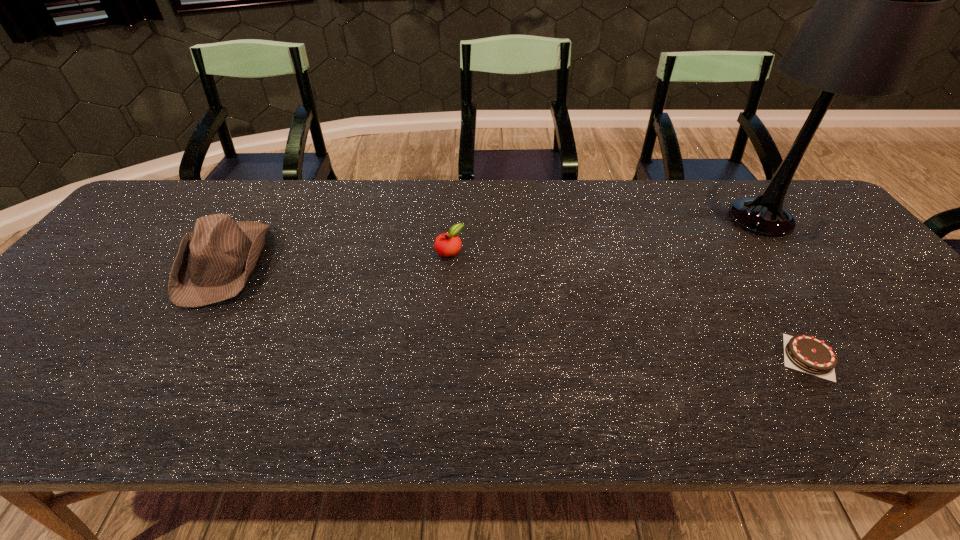
I want to click on table lamp, so click(x=878, y=0).

Image resolution: width=960 pixels, height=540 pixels. Find the location of `fedora`. fedora is located at coordinates (214, 262).

Identify the location of the leftmost object. The image size is (960, 540). (214, 262).

This screenshot has width=960, height=540. In order to click on the third object from right to left in this screenshot , I will do click(x=448, y=244).

Find the location of `the second shortest object`. the second shortest object is located at coordinates (448, 244).

Locate an element on the screen. The image size is (960, 540). the shortest object is located at coordinates (805, 353).

Image resolution: width=960 pixels, height=540 pixels. I want to click on the nearest object, so click(x=805, y=353).

At what (x,y) coordinates should I click in order to perform the action: click on free region located on the left of the table lamp. Please return your answer as a coordinate pair (x, y). This screenshot has height=540, width=960. Looking at the image, I should click on (623, 218).

At what (x,y) coordinates should I click in order to perform the action: click on vacant area situated 0.180m on the left of the fedora. Please return your answer as a coordinate pair (x, y). This screenshot has width=960, height=540. Looking at the image, I should click on (113, 264).

The image size is (960, 540). Identify the location of vacant space located on the front of the apple. 444,333.